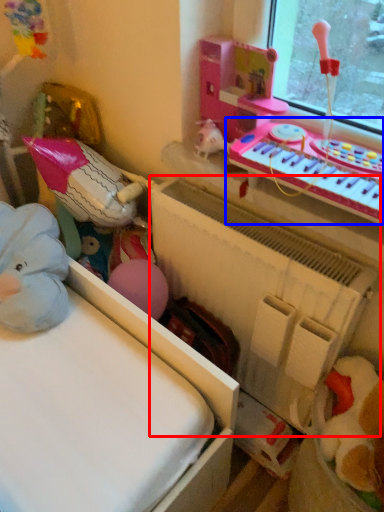
Question: Which object appears farthest to the camera in this image, radiator (highlighted by a red box) or musical keyboard (highlighted by a blue box)?

Choices:
 (A) radiator
 (B) musical keyboard

Answer: (A)